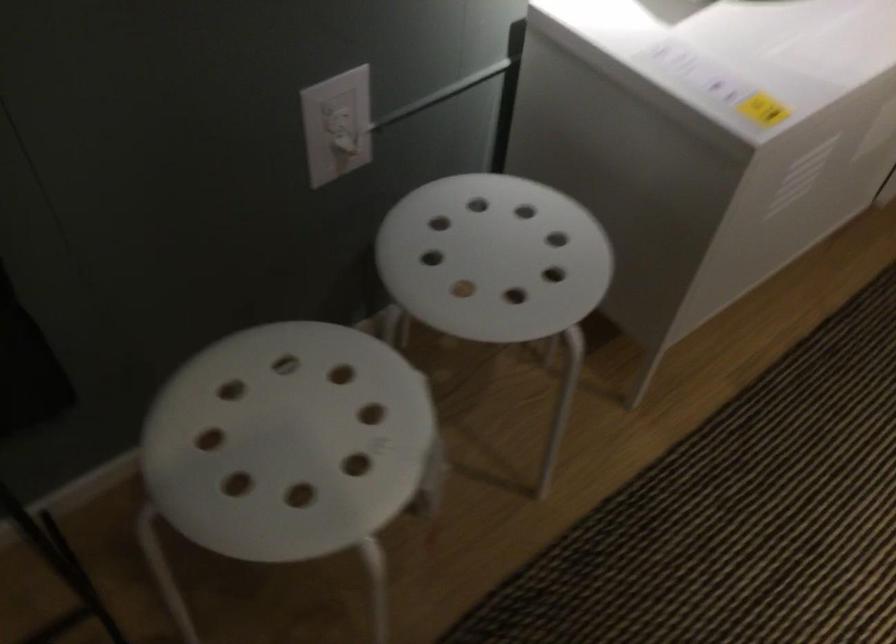
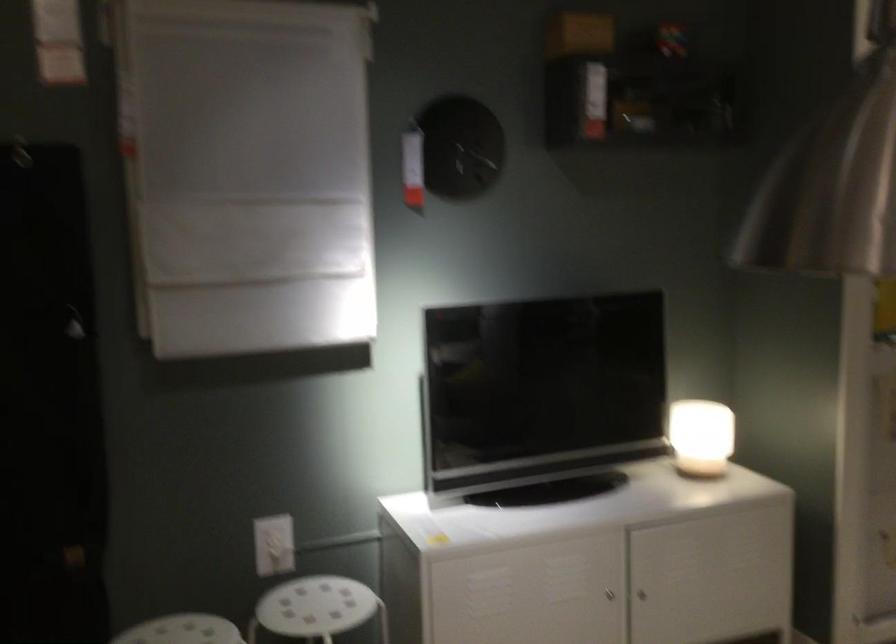
Locate, in the second image, the point that corresponds to [334,124] in the first image.

(273, 545)